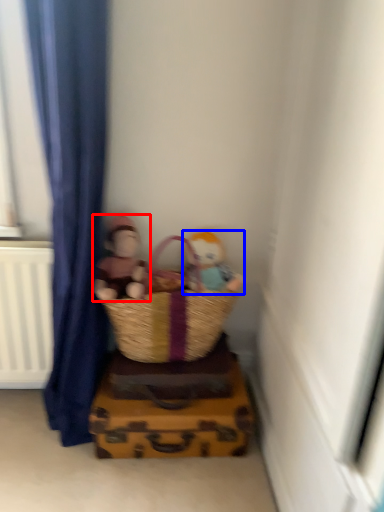
Question: Which of the following is the closest to the observer, person (highlighted by a red box) or person (highlighted by a blue box)?

Choices:
 (A) person
 (B) person

Answer: (A)